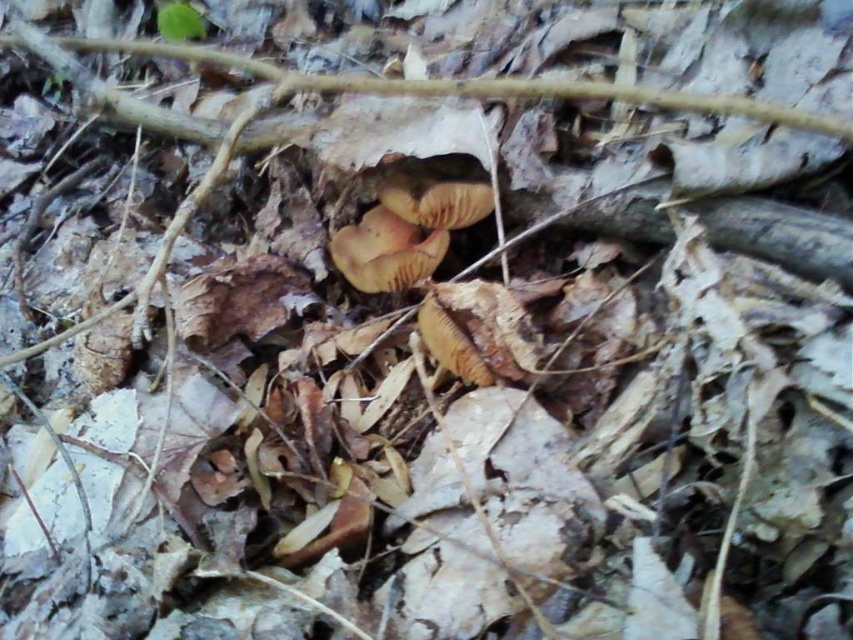
You are a mycologist examining two mushrooms in the forest. You notice the brown matte fungi at center and the brown fuzzy mushroom at center. Which one is located above the other?

The brown matte fungi at center is positioned over brown fuzzy mushroom at center, so it is located above the other.

You are a small animal looking for shelter. You see a brown matte twig at upper center and a brown fuzzy mushroom at center. Which one is taller and could provide better coverage?

The brown matte twig at upper center is taller than the brown fuzzy mushroom at center, so it would provide better coverage.

You are a small animal foraging for food in the forest. You see a brown fuzzy mushroom at center and a brown matte twig at upper center. Which item is closer to you?

The brown fuzzy mushroom at center is closer to you because it is located at the center of the image, while the brown matte twig at upper center is positioned higher up, making it farther away.